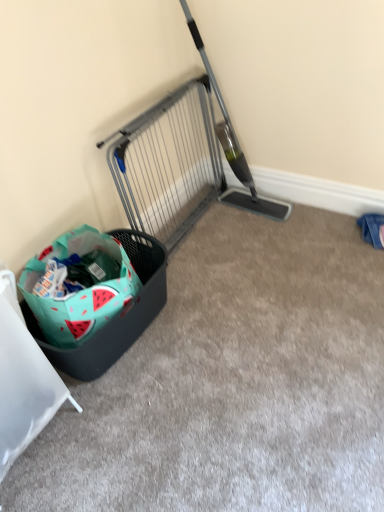
Question: Is teal fabric basket at lower left bigger than watermelon-patterned fabric shopping bag at lower left?

Choices:
 (A) no
 (B) yes

Answer: (B)

Question: From the image's perspective, is teal fabric basket at lower left under watermelon-patterned fabric shopping bag at lower left?

Choices:
 (A) yes
 (B) no

Answer: (A)

Question: Does teal fabric basket at lower left come behind watermelon-patterned fabric shopping bag at lower left?

Choices:
 (A) no
 (B) yes

Answer: (A)

Question: Does teal fabric basket at lower left have a greater height compared to watermelon-patterned fabric shopping bag at lower left?

Choices:
 (A) no
 (B) yes

Answer: (B)

Question: Is teal fabric basket at lower left not within watermelon-patterned fabric shopping bag at lower left?

Choices:
 (A) yes
 (B) no

Answer: (A)

Question: Based on their positions, is metallic gray gate at upper center located to the left or right of watermelon-patterned fabric shopping bag at lower left?

Choices:
 (A) left
 (B) right

Answer: (B)

Question: Considering the positions of metallic gray gate at upper center and watermelon-patterned fabric shopping bag at lower left in the image, is metallic gray gate at upper center bigger or smaller than watermelon-patterned fabric shopping bag at lower left?

Choices:
 (A) small
 (B) big

Answer: (B)

Question: In terms of width, does metallic gray gate at upper center look wider or thinner when compared to watermelon-patterned fabric shopping bag at lower left?

Choices:
 (A) thin
 (B) wide

Answer: (A)

Question: From a real-world perspective, is metallic gray gate at upper center physically located above or below watermelon-patterned fabric shopping bag at lower left?

Choices:
 (A) above
 (B) below

Answer: (A)

Question: From a real-world perspective, relative to watermelon-patterned fabric shopping bag at lower left, is teal fabric basket at lower left vertically above or below?

Choices:
 (A) below
 (B) above

Answer: (B)

Question: Is teal fabric basket at lower left taller or shorter than watermelon-patterned fabric shopping bag at lower left?

Choices:
 (A) short
 (B) tall

Answer: (B)

Question: In the image, is teal fabric basket at lower left positioned in front of or behind watermelon-patterned fabric shopping bag at lower left?

Choices:
 (A) behind
 (B) front

Answer: (B)

Question: From the image's perspective, relative to watermelon-patterned fabric shopping bag at lower left, is teal fabric basket at lower left above or below?

Choices:
 (A) above
 (B) below

Answer: (B)

Question: Does point (162, 104) appear closer or farther from the camera than point (43, 380)?

Choices:
 (A) closer
 (B) farther

Answer: (B)

Question: In the image, is metallic gray gate at upper center positioned in front of or behind teal fabric basket at lower left?

Choices:
 (A) behind
 (B) front

Answer: (A)